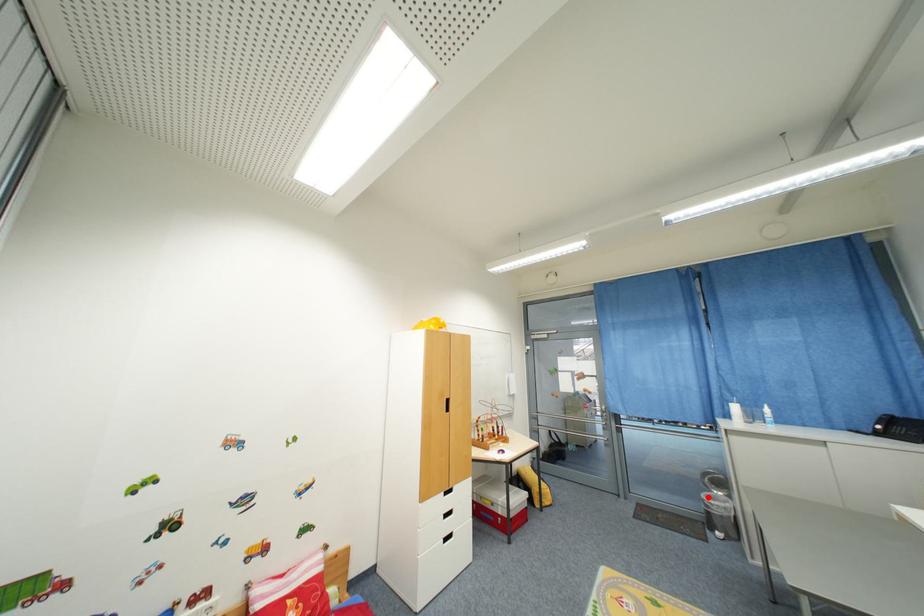
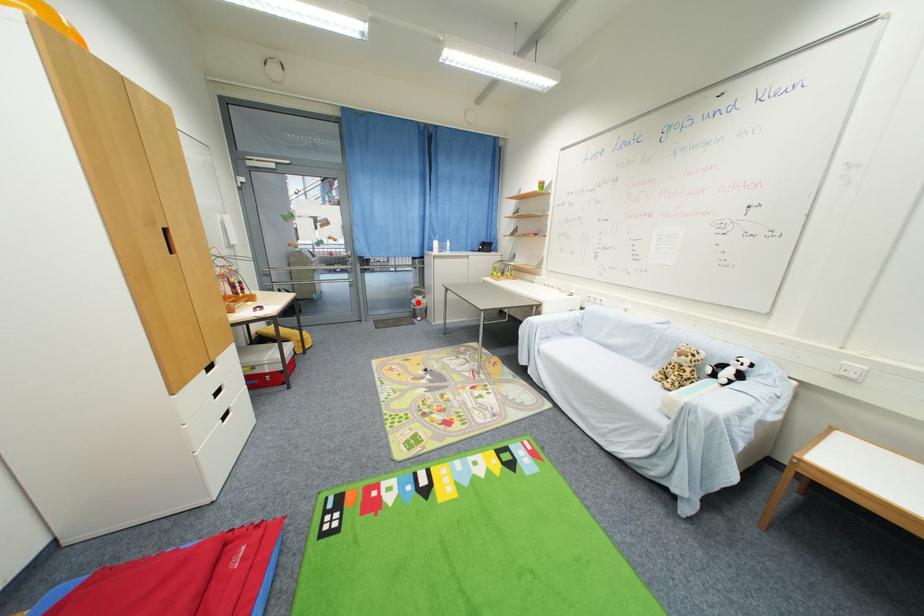
I am providing you with two images of the same scene from different viewpoints. A red point is marked on the first image and another point is marked on the second image. Is the red point in image1 aligned with the point shown in image2?

Yes